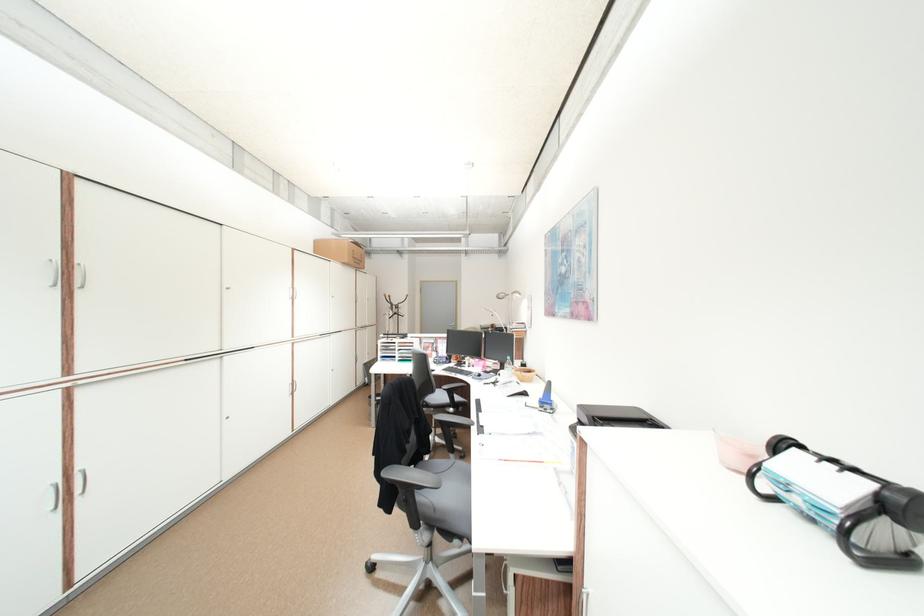
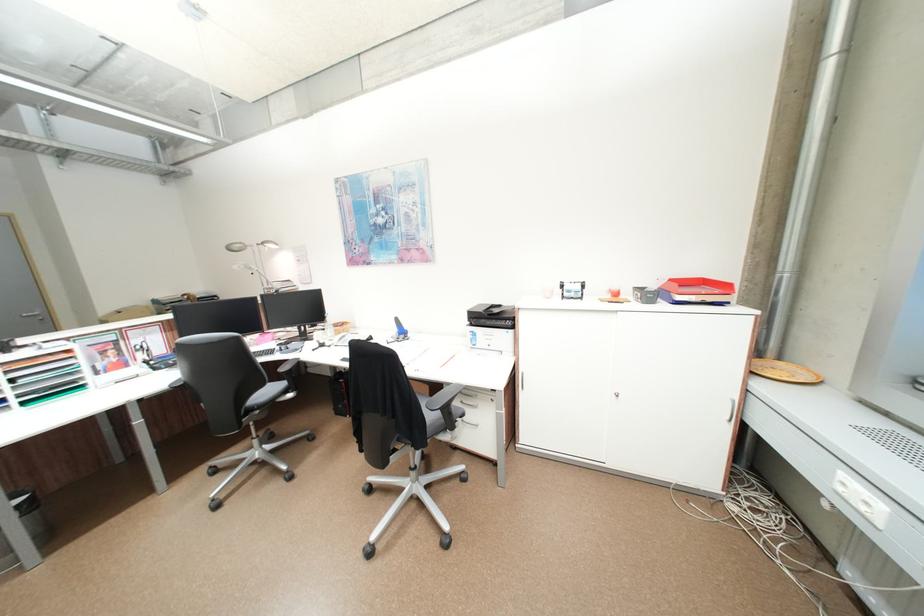
Locate, in the second image, the point that corresponds to [511,298] in the first image.

(245, 249)